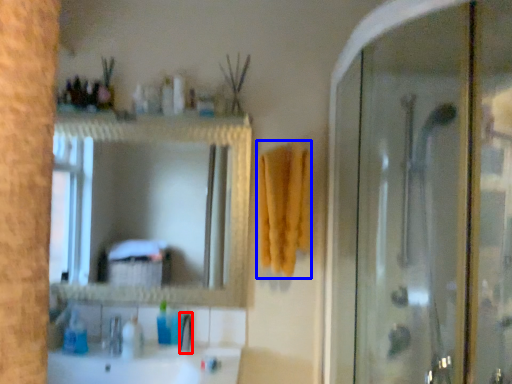
Question: Which point is further to the camera, faucet (highlighted by a red box) or bath towel (highlighted by a blue box)?

Choices:
 (A) faucet
 (B) bath towel

Answer: (A)